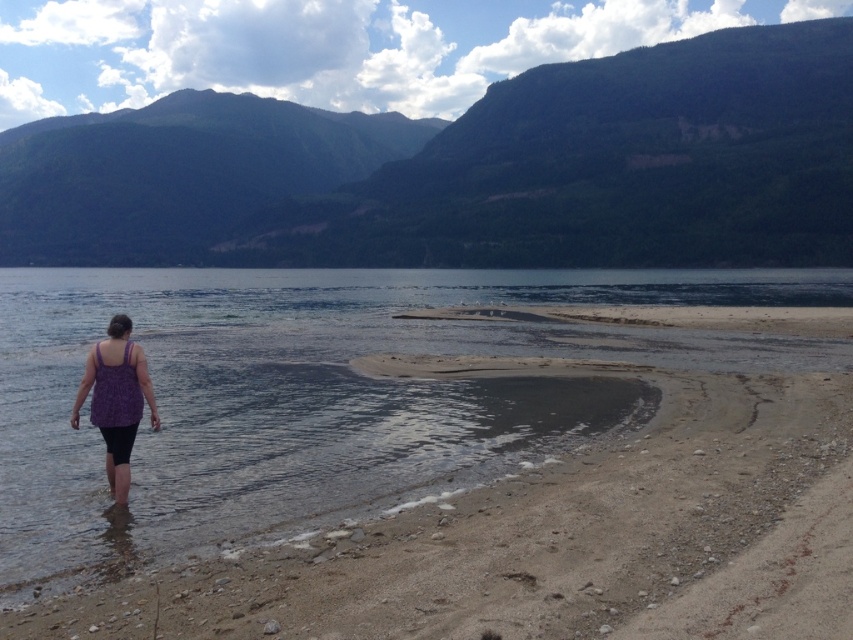
You are standing at the lakeside and want to take a photo of the green forested mountain at upper center. If your camera can focus on objects up to 700 feet away, will it be able to capture the mountain clearly?

The distance of green forested mountain at upper center from the camera is 679.58 feet, which is within the camera focus range of 700 feet. Therefore, the camera can capture the mountain clearly.

You are standing at the center of the image and want to walk to the sandy beach at lower left. According to the coordinates provided, which direction should you head?

The sandy beach at lower left is located at point (550,536), which means you should head towards the lower left direction to reach it.

You are a photographer trying to capture the purple fabric tank top at lower left and the sandy beach at lower left in the same frame. Based on their positions, which object is closer to the camera?

The purple fabric tank top at lower left is closer to the camera because it is positioned above the sandy beach at lower left, which is below it.